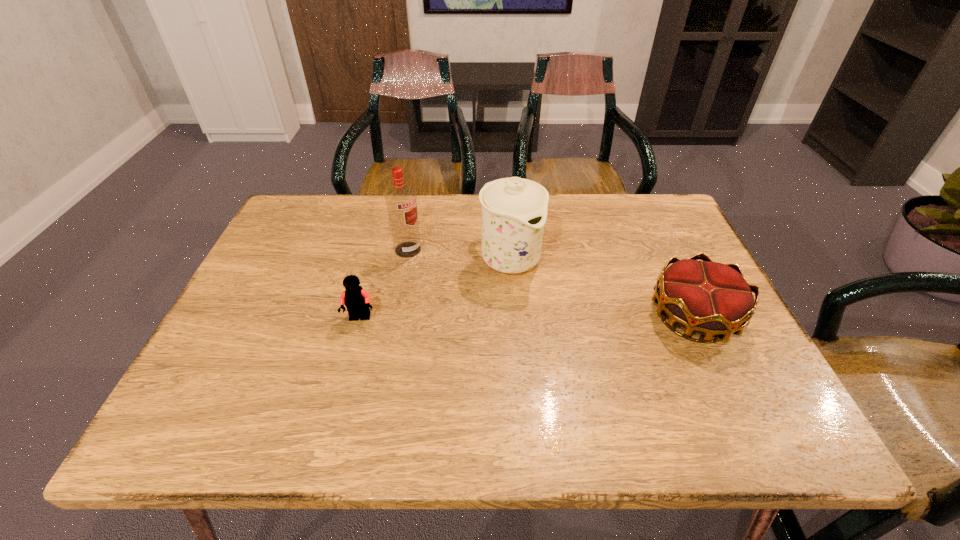
Find the location of a particular element. The height and width of the screenshot is (540, 960). free spot on the desktop that is between the Lego and the crown and is positioned on the front label of the vodka is located at coordinates (524, 317).

The image size is (960, 540). I want to click on free space on the desktop that is between the Lego and the rightmost object and is positioned on the spout of the chinaware, so click(x=567, y=317).